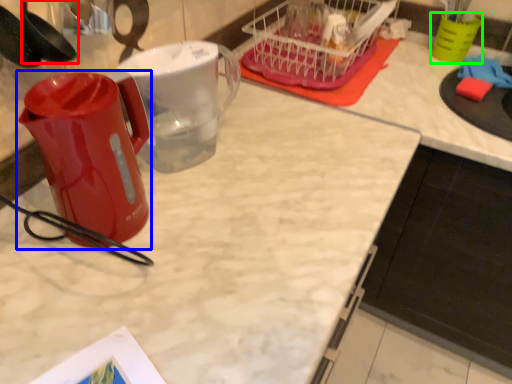
Question: Estimate the real-world distances between objects in this image. Which object is closer to spoon (highlighted by a red box), kettle (highlighted by a blue box) or coffee cup (highlighted by a green box)?

Choices:
 (A) kettle
 (B) coffee cup

Answer: (A)